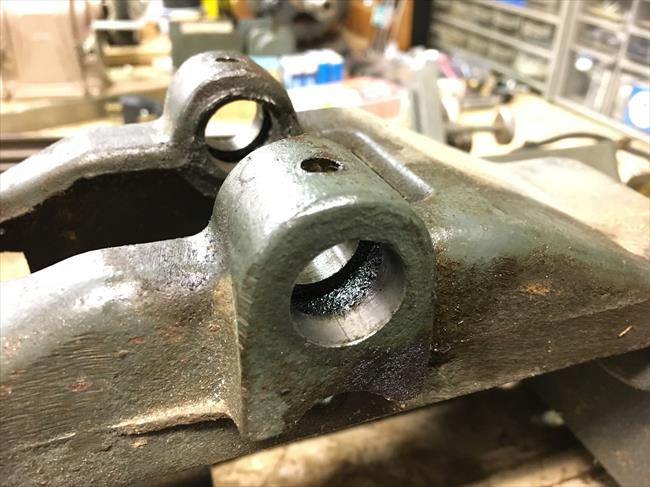
At what (x,y) coordinates should I click in order to perform the action: click on books. Please return your answer as a coordinate pair (x, y). Looking at the image, I should click on (294, 79), (309, 77), (322, 71), (337, 68).